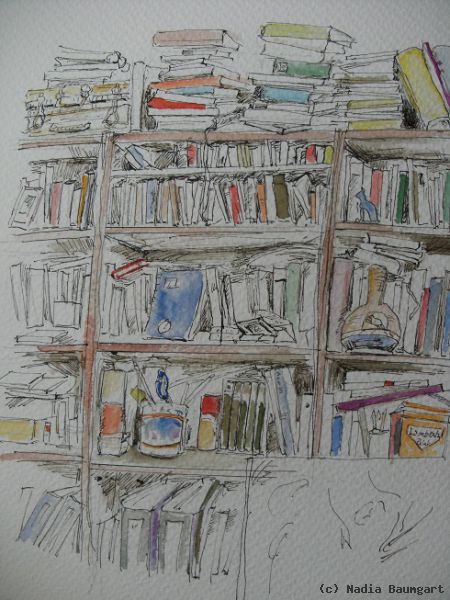
At what (x,y) coordinates should I click in order to perform the action: click on yellow book. Please return your answer as a coordinate pair (x, y). Image resolution: width=450 pixels, height=600 pixels. Looking at the image, I should click on [420, 92], [380, 105], [380, 125], [324, 153], [97, 87], [426, 431].